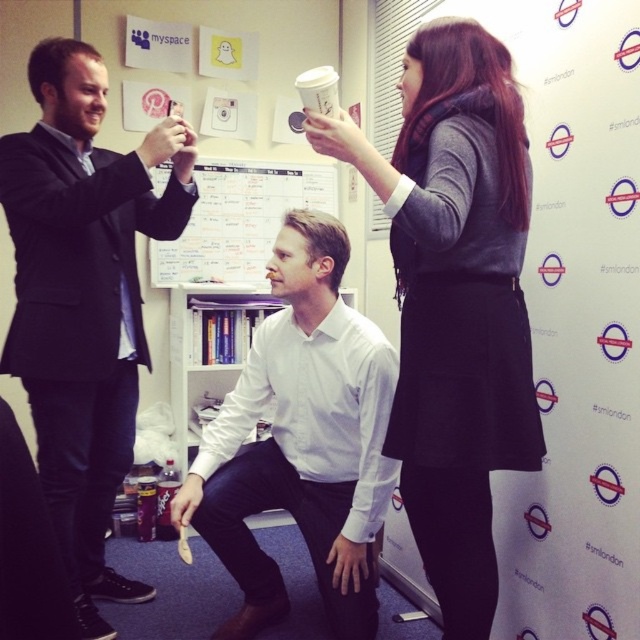
In the scene shown: Can you confirm if white smooth shirt at center is wider than white paper cup at upper center?

Indeed, white smooth shirt at center has a greater width compared to white paper cup at upper center.

Who is shorter, white smooth shirt at center or white paper cup at upper center?

white paper cup at upper center

Between point (292, 372) and point (316, 92), which one is positioned behind?

The point (292, 372) is behind.

What are the coordinates of `white smooth shirt at center` in the screenshot? It's located at (301, 440).

Identify the location of black suit at left. (83, 300).

Is point (163, 122) behind point (280, 502)?

No, it is not.

Locate an element on the screen. black suit at left is located at coordinates (83, 300).

Between white smooth shirt at center and whiteboard at center, which one appears on the left side from the viewer's perspective?

whiteboard at center

How far apart are white smooth shirt at center and whiteboard at center?

The distance of white smooth shirt at center from whiteboard at center is 4.63 feet.

You are a GUI agent. You are given a task and a screenshot of the screen. Output one action in this format:
    pyautogui.click(x=<x>, y=<y>)
    Task: Click on the white smooth shirt at center
    
    Given the screenshot: What is the action you would take?
    pyautogui.click(x=301, y=440)